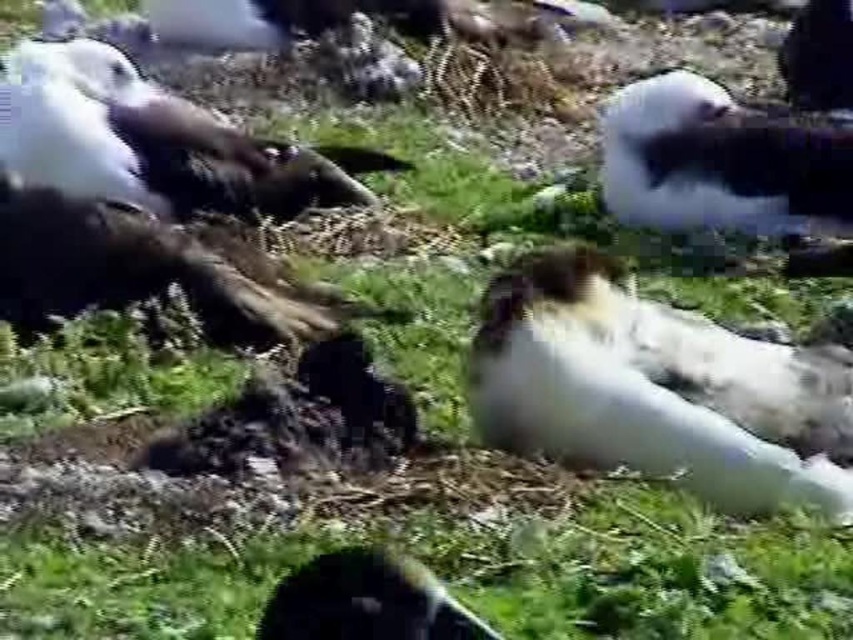
You are observing a group of birds on a grassy area. There is a white fluffy bird at center and a white fluffy bird at upper right. Which bird is positioned more to the left?

The white fluffy bird at center is positioned more to the left than the white fluffy bird at upper right.

You are a wildlife photographer aiming to capture a photo of the white fluffy bird at upper right and the white fluffy mollymawk at lower center. Which bird should you focus on first if you want to photograph the larger one?

The white fluffy bird at upper right is bigger than the white fluffy mollymawk at lower center, so you should focus on the white fluffy bird at upper right first.